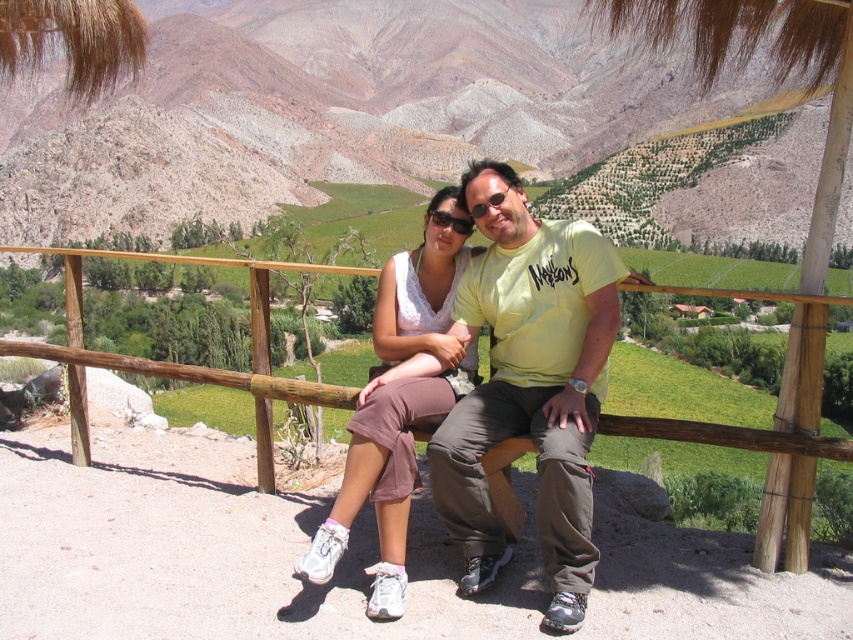
Is yellow cotton t-shirt at center smaller than matte white tank top at center?

No, yellow cotton t-shirt at center is not smaller than matte white tank top at center.

Who is more distant from viewer, (x=496, y=563) or (x=445, y=394)?

The point (x=445, y=394) is more distant.

Who is more forward, (485,406) or (358,404)?

Point (485,406)

Locate an element on the screen. yellow cotton t-shirt at center is located at coordinates (529, 385).

Which of these two, rustic stone mountains at upper center or matte white tank top at center, stands taller?

With more height is rustic stone mountains at upper center.

Does rustic stone mountains at upper center have a greater width compared to matte white tank top at center?

Indeed, rustic stone mountains at upper center has a greater width compared to matte white tank top at center.

Between point (41, 84) and point (454, 243), which one is positioned behind?

Positioned behind is point (41, 84).

Where is `rustic stone mountains at upper center`? This screenshot has height=640, width=853. rustic stone mountains at upper center is located at coordinates (329, 109).

Measure the distance from rustic stone mountains at upper center to wooden rail at center.

rustic stone mountains at upper center and wooden rail at center are 928.14 feet apart.

Does rustic stone mountains at upper center appear on the right side of wooden rail at center?

In fact, rustic stone mountains at upper center is to the left of wooden rail at center.

Who is more distant from viewer, (352, 65) or (813, 445)?

Positioned behind is point (352, 65).

This screenshot has width=853, height=640. What are the coordinates of `rustic stone mountains at upper center` in the screenshot? It's located at (329, 109).